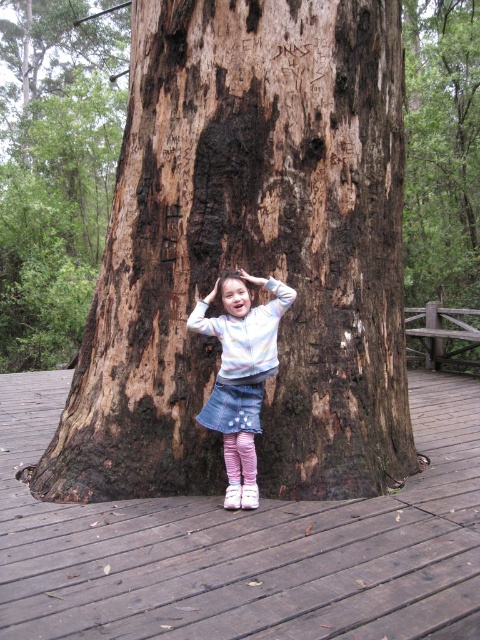
You are a hiker who wants to take a photo of the wooden at lower center. Since the brown rough tree trunk at center is blocking your view, can you move to the left or right to get a clear shot?

The wooden at lower center is behind the brown rough tree trunk at center, so moving to the left or right might allow you to see around the trunk and capture the wooden object in your photo.

You are a photographer trying to capture the girl and the tree in the image. You want to focus on the point closer to the camera. Which point should you choose between point (103, 432) and point (397, 497)?

Point (103, 432) is further to the camera than point (397, 497), so you should choose point (103, 432) to focus on the point closer to the camera.

You are a photographer trying to capture the brown rough tree trunk at center and the denim skirt at center in a single shot. Which object should you focus on first to ensure both are in sharp focus?

You should focus on the brown rough tree trunk at center first because it is closer to you than the denim skirt at center, so focusing on the closer object ensures both will be in focus.